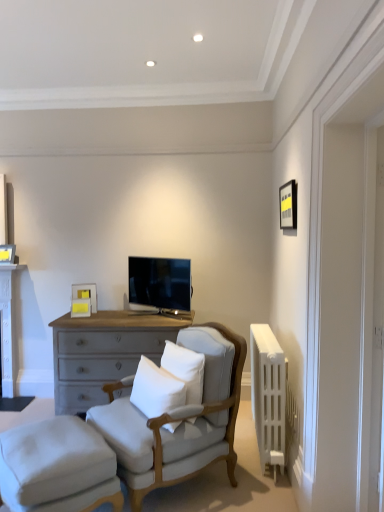
What is the approximate width of white fabric stool at lower left?

white fabric stool at lower left is 20.70 inches wide.

The width and height of the screenshot is (384, 512). I want to click on light gray fabric chair at center, so click(180, 424).

In order to click on white fabric stool at lower left in this screenshot , I will do `click(57, 467)`.

From a real-world perspective, is white fabric stool at lower left under light gray fabric chair at center?

Correct, in the physical world, white fabric stool at lower left is lower than light gray fabric chair at center.

Consider the image. Is white fabric stool at lower left wider than light gray fabric chair at center?

No.

Is white fabric stool at lower left taller than light gray fabric chair at center?

No.

Which is more to the right, white fabric stool at lower left or light gray fabric chair at center?

light gray fabric chair at center is more to the right.

Choose the correct answer: Is white soft cushion at center, which is the first pillow from left to right, inside white fabric stool at lower left or outside it?

white soft cushion at center, which is the first pillow from left to right, lies outside white fabric stool at lower left.

From the image's perspective, is white soft cushion at center, the 2th pillow in the right-to-left sequence, located above white fabric stool at lower left?

Indeed, from the image's perspective, white soft cushion at center, the 2th pillow in the right-to-left sequence, is shown above white fabric stool at lower left.

Based on the photo, does white soft cushion at center, which is the first pillow from left to right, have a larger size compared to white fabric stool at lower left?

Actually, white soft cushion at center, which is the first pillow from left to right, might be smaller than white fabric stool at lower left.

From the picture: Does white soft cushion at center, the 2th pillow in the right-to-left sequence, turn towards white fabric stool at lower left?

No, white soft cushion at center, the 2th pillow in the right-to-left sequence, is not turned towards white fabric stool at lower left.

From the image's perspective, is white plastic radiator at right above or below white fabric stool at lower left?

white plastic radiator at right is situated higher than white fabric stool at lower left in the image.

From the picture: Which object is thinner, white plastic radiator at right or white fabric stool at lower left?

white plastic radiator at right.

In the scene shown: Is white plastic radiator at right not inside white fabric stool at lower left?

Absolutely, white plastic radiator at right is external to white fabric stool at lower left.

From a real-world perspective, does white plastic radiator at right stand above white fabric stool at lower left?

Correct, in the physical world, white plastic radiator at right is higher than white fabric stool at lower left.

From the image's perspective, is white fabric stool at lower left above or below white painted wood table at left?

Based on their image positions, white fabric stool at lower left is located beneath white painted wood table at left.

Which object is wider, white fabric stool at lower left or white painted wood table at left?

With larger width is white fabric stool at lower left.

From the picture: Does white fabric stool at lower left turn towards white painted wood table at left?

No.

From a real-world perspective, who is located lower, white fabric stool at lower left or white painted wood table at left?

white fabric stool at lower left.

Measure the distance between white painted wood table at left and white soft cushion at center, the 2th pillow in the right-to-left sequence.

white painted wood table at left and white soft cushion at center, the 2th pillow in the right-to-left sequence, are 6.92 feet apart.

From the image's perspective, between white painted wood table at left and white soft cushion at center, which is the first pillow from left to right, which one is located above?

white painted wood table at left, from the image's perspective.

Between white painted wood table at left and white soft cushion at center, the 2th pillow in the right-to-left sequence, which one has smaller size?

white soft cushion at center, the 2th pillow in the right-to-left sequence, is smaller.

Is white painted wood table at left completely or partially outside of white soft cushion at center, which is the first pillow from left to right?

That's correct, white painted wood table at left is outside of white soft cushion at center, which is the first pillow from left to right.

Is matte black tv at center located outside white painted wood table at left?

Absolutely, matte black tv at center is external to white painted wood table at left.

Locate an element on the screen. Image resolution: width=384 pixels, height=512 pixels. table that appears on the left of matte black tv at center is located at coordinates (9, 327).

Which is less distant, (174, 285) or (8, 348)?

Point (174, 285) appears to be closer to the viewer than point (8, 348).

From a real-world perspective, relative to white painted wood table at left, is matte black tv at center vertically above or below?

matte black tv at center is situated higher than white painted wood table at left in the real world.

Does white soft cushion at center, arranged as the second pillow when viewed from the left, have a lesser width compared to white soft cushion at center, the 2th pillow in the right-to-left sequence?

No.

Based on the photo, what's the angular difference between white soft cushion at center, arranged as the second pillow when viewed from the left, and white soft cushion at center, which is the first pillow from left to right,'s facing directions?

3.88 degrees separate the facing orientations of white soft cushion at center, arranged as the second pillow when viewed from the left, and white soft cushion at center, which is the first pillow from left to right.

Does white soft cushion at center, arranged as the second pillow when viewed from the left, come behind white soft cushion at center, which is the first pillow from left to right?

Yes, it is behind white soft cushion at center, which is the first pillow from left to right.

From a real-world perspective, is white soft cushion at center, marked as the first pillow in a right-to-left arrangement, under white soft cushion at center, which is the first pillow from left to right?

No, from a real-world perspective, white soft cushion at center, marked as the first pillow in a right-to-left arrangement, is not beneath white soft cushion at center, which is the first pillow from left to right.

Where is `chair that appears above the white fabric stool at lower left (from a real-world perspective)`? chair that appears above the white fabric stool at lower left (from a real-world perspective) is located at coordinates (180, 424).

Locate an element on the screen. The height and width of the screenshot is (512, 384). stool that is under the white soft cushion at center, which is the first pillow from left to right (from a real-world perspective) is located at coordinates (57, 467).

Consider the image. From the image, which object appears to be nearer to light gray fabric chair at center, white plastic radiator at right or white soft cushion at center, marked as the first pillow in a right-to-left arrangement?

white soft cushion at center, marked as the first pillow in a right-to-left arrangement, is closer to light gray fabric chair at center.

Looking at the image, which one is located further to white soft cushion at center, arranged as the second pillow when viewed from the left, white fabric stool at lower left or white soft cushion at center, the 2th pillow in the right-to-left sequence?

The object further to white soft cushion at center, arranged as the second pillow when viewed from the left, is white fabric stool at lower left.

Based on their spatial positions, is white soft cushion at center, marked as the first pillow in a right-to-left arrangement, or white painted wood table at left further from white soft cushion at center, the 2th pillow in the right-to-left sequence?

The object further to white soft cushion at center, the 2th pillow in the right-to-left sequence, is white painted wood table at left.

Considering their positions, is white plastic radiator at right positioned further to white fabric stool at lower left than matte black tv at center?

matte black tv at center is further to white fabric stool at lower left.

Based on their spatial positions, is white soft cushion at center, arranged as the second pillow when viewed from the left, or white plastic radiator at right closer to white painted wood table at left?

white soft cushion at center, arranged as the second pillow when viewed from the left, lies closer to white painted wood table at left than the other object.

From the picture: From the image, which object appears to be nearer to light gray fabric chair at center, matte black tv at center or white painted wood table at left?

matte black tv at center is positioned closer to the anchor light gray fabric chair at center.

Estimate the real-world distances between objects in this image. Which object is further from light gray fabric chair at center, white soft cushion at center, arranged as the second pillow when viewed from the left, or white fabric stool at lower left?

white fabric stool at lower left is further to light gray fabric chair at center.

Which object lies further to the anchor point white soft cushion at center, marked as the first pillow in a right-to-left arrangement, white fabric stool at lower left or white painted wood table at left?

The object further to white soft cushion at center, marked as the first pillow in a right-to-left arrangement, is white painted wood table at left.

Find the location of a particular element. The width and height of the screenshot is (384, 512). pillow located between white soft cushion at center, which is the first pillow from left to right, and white plastic radiator at right in the left-right direction is located at coordinates (185, 369).

You are a GUI agent. You are given a task and a screenshot of the screen. Output one action in this format:
    pyautogui.click(x=<x>, y=<y>)
    Task: Click on the pillow located between light gray fabric chair at center and white plastic radiator at right in the left-right direction
    This screenshot has height=512, width=384.
    Given the screenshot: What is the action you would take?
    pyautogui.click(x=185, y=369)

Locate an element on the screen. The height and width of the screenshot is (512, 384). radiator between light gray fabric chair at center and matte black tv at center from front to back is located at coordinates (268, 395).

Identify the location of pillow between white painted wood table at left and white soft cushion at center, marked as the first pillow in a right-to-left arrangement. Image resolution: width=384 pixels, height=512 pixels. (156, 389).